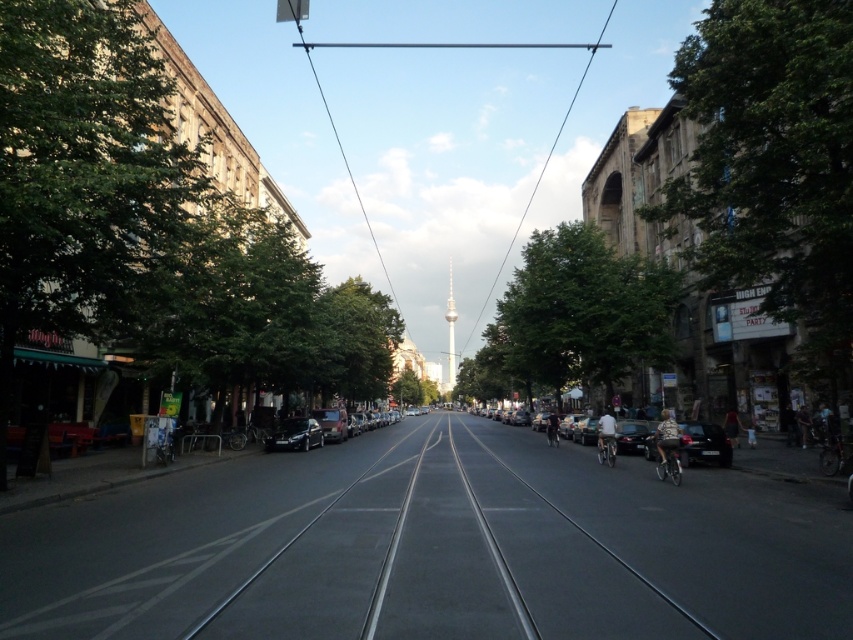
Question: Based on their relative distances, which object is nearer to the black asphalt train track at center?

Choices:
 (A) matte black car at center-right
 (B) shiny black car at center

Answer: (A)

Question: Does black asphalt train track at center come behind shiny black car at center?

Choices:
 (A) no
 (B) yes

Answer: (A)

Question: Which object appears closest to the camera in this image?

Choices:
 (A) matte black car at center-right
 (B) black asphalt train track at center
 (C) shiny black car at center
 (D) metallic wire at center

Answer: (B)

Question: Which point is closer to the camera?

Choices:
 (A) shiny black car at center
 (B) metallic wire at center
 (C) black asphalt train track at center

Answer: (C)

Question: Does black asphalt train track at center appear on the left side of metallic wire at center?

Choices:
 (A) yes
 (B) no

Answer: (B)

Question: Does matte black car at center-right have a smaller size compared to shiny black car at center?

Choices:
 (A) no
 (B) yes

Answer: (A)